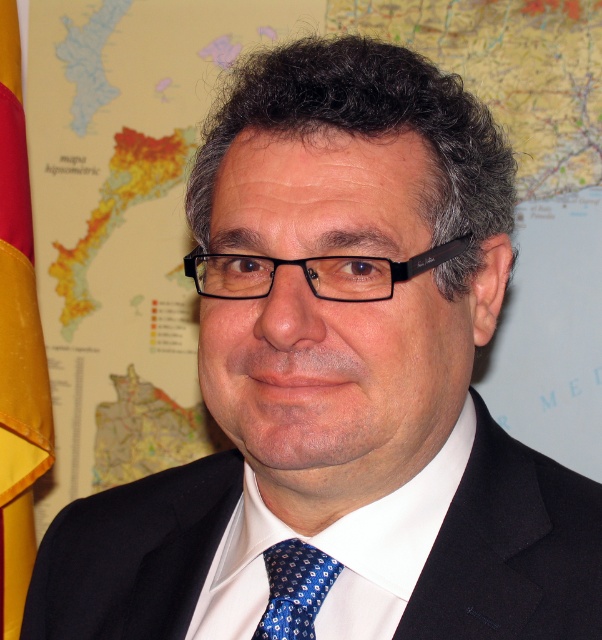
You are a photographer setting up for a formal portrait. You notice the white smooth dress shirt at center and the yellow satin flag at left in the background. Which object is positioned lower in the frame?

The white smooth dress shirt at center is located below the yellow satin flag at left, so it is positioned lower in the frame.

Consider the image. You are a tailor measuring the distance between the white smooth dress shirt at center and the black plastic glasses at center for a custom fit. Can you fit a 7.5 inch wide accessory between them?

The white smooth dress shirt at center and black plastic glasses at center are 8.09 inches apart from each other, so yes, a 7.5 inch wide accessory can fit between them since the space is wider than the accessory.

Looking at this image, you are a photographer setting up for a formal portrait. The subject is wearing a white smooth dress shirt at center and black plastic glasses at center. To ensure the glasses are properly lit, where should you position the main light relative to the shirt?

The white smooth dress shirt at center is below the black plastic glasses at center. To ensure the glasses are properly lit, position the main light above the glasses so that it illuminates the shirt below without casting shadows on the glasses.